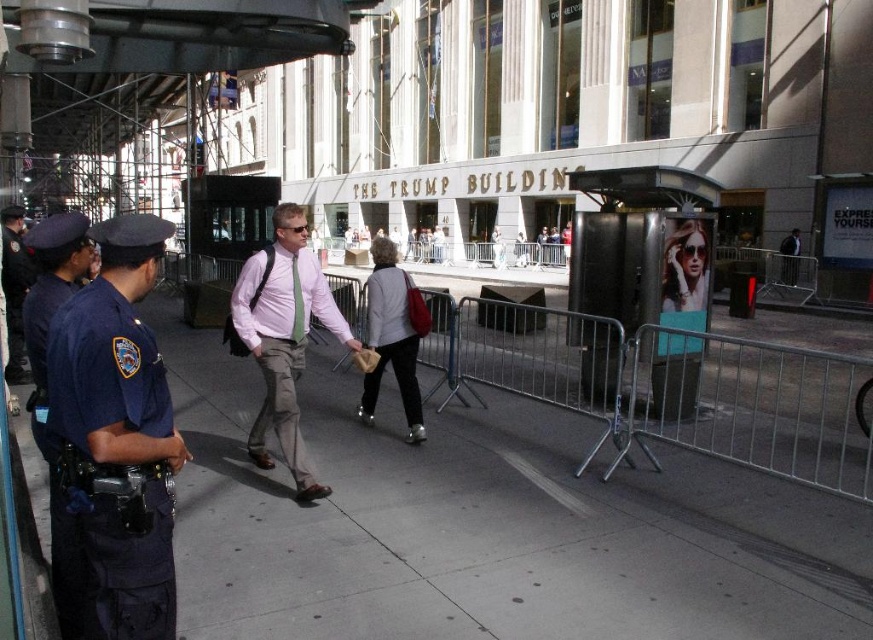
Is metallic silver barrier at center further to camera compared to blue uniform at left?

Yes, metallic silver barrier at center is further from the viewer.

Find the location of a particular element. The image size is (873, 640). metallic silver barrier at center is located at coordinates (664, 387).

Is blue uniform at left to the right of dark blue uniform at left from the viewer's perspective?

Yes, blue uniform at left is to the right of dark blue uniform at left.

Can you confirm if blue uniform at left is positioned below dark blue uniform at left?

Indeed, blue uniform at left is positioned under dark blue uniform at left.

What do you see at coordinates (112, 356) in the screenshot? I see `blue uniform at left` at bounding box center [112, 356].

You are a GUI agent. You are given a task and a screenshot of the screen. Output one action in this format:
    pyautogui.click(x=<x>, y=<y>)
    Task: Click on the blue uniform at left
    The width and height of the screenshot is (873, 640).
    Given the screenshot: What is the action you would take?
    coord(112,356)

In the scene shown: Who is more distant from viewer, [182,490] or [458,308]?

The point [458,308] is more distant.

Find the location of a particular element. The width and height of the screenshot is (873, 640). gray concrete sidewalk at center is located at coordinates (486, 525).